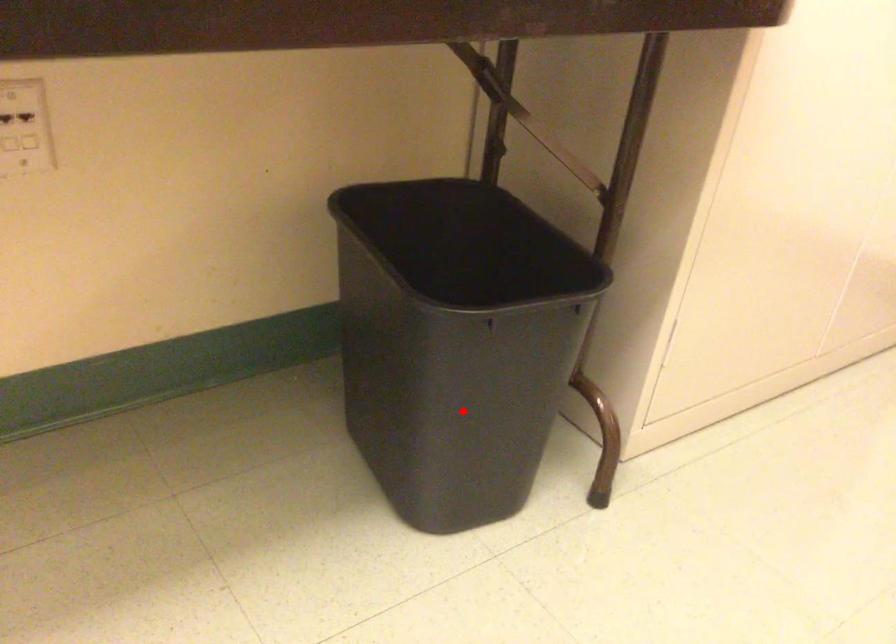
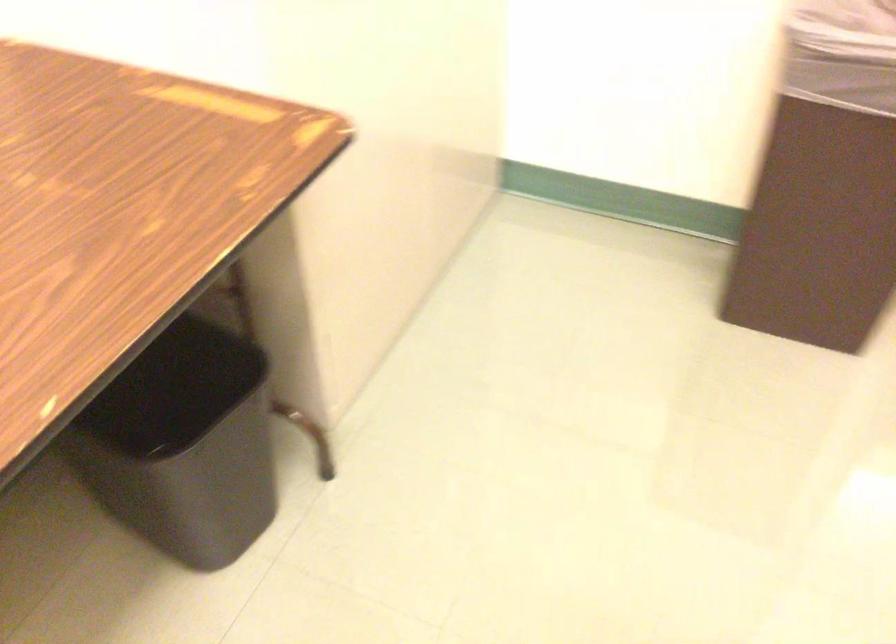
Question: I am providing you with two images of the same scene from different viewpoints. Given a red point in image1, look at the same physical point in image2. Is it:

Choices:
 (A) Closer to the viewpoint
 (B) Farther from the viewpoint

Answer: (B)